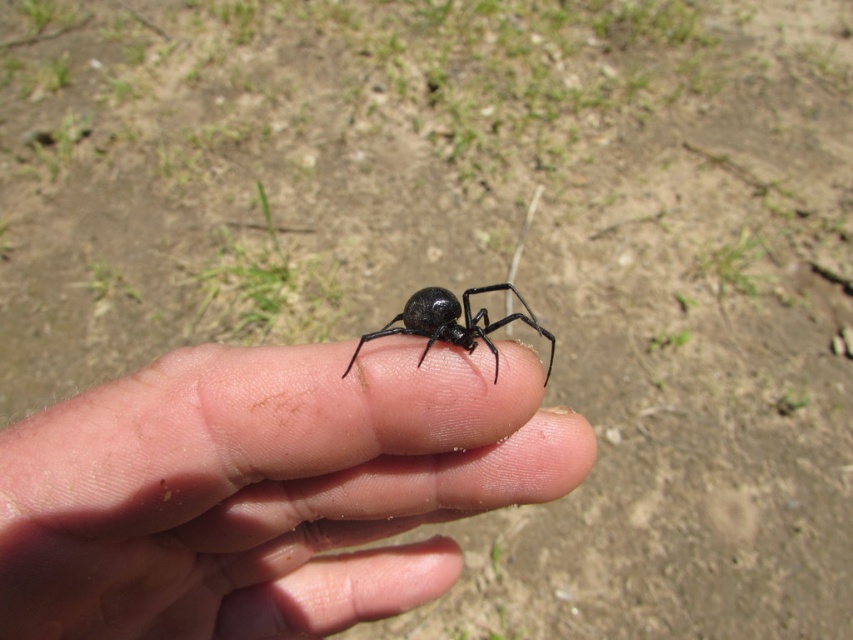
Can you confirm if smooth skin at center is taller than black matte spider at center?

Yes, smooth skin at center is taller than black matte spider at center.

Is point (223, 419) more distant than point (376, 332)?

No, (223, 419) is closer to viewer.

Where is `smooth skin at center`? This screenshot has height=640, width=853. smooth skin at center is located at coordinates 265,488.